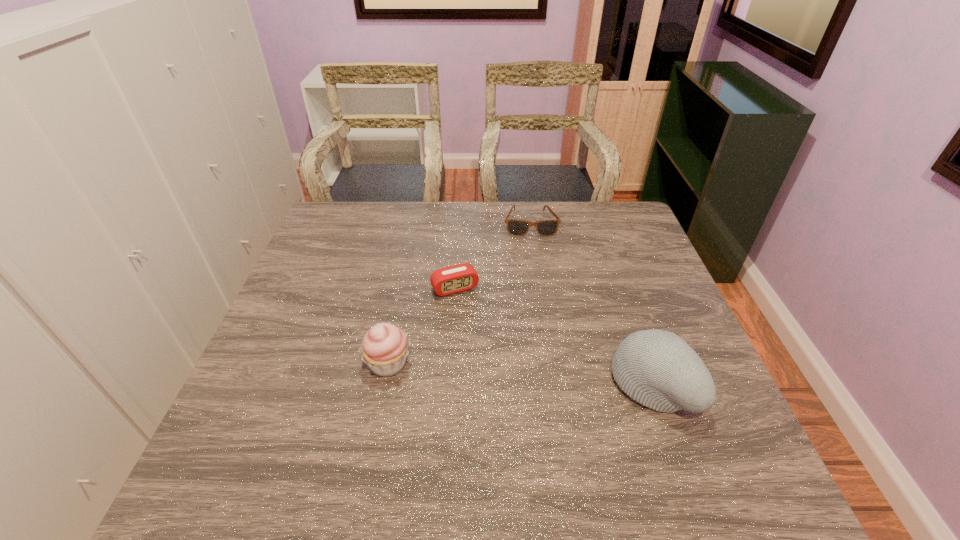
In the image, there is a desktop. Identify the location of free region at the left edge. (240, 396).

Find the location of a particular element. This screenshot has width=960, height=540. vacant space at the right edge is located at coordinates (680, 336).

Locate an element on the screen. This screenshot has height=540, width=960. vacant space at the far left corner is located at coordinates (345, 207).

Where is `vacant point at the far right corner`? The width and height of the screenshot is (960, 540). vacant point at the far right corner is located at coordinates (592, 230).

The width and height of the screenshot is (960, 540). What are the coordinates of `vacant area between the farthest object and the beanie` in the screenshot? It's located at (591, 304).

In order to click on unoccupied area between the second farthest object and the farthest object in this screenshot , I will do `click(492, 256)`.

Where is `vacant space that is in between the beanie and the alarm clock`? The width and height of the screenshot is (960, 540). vacant space that is in between the beanie and the alarm clock is located at coordinates (554, 336).

The image size is (960, 540). Find the location of `free space between the farthest object and the cupcake`. free space between the farthest object and the cupcake is located at coordinates (460, 294).

At what (x,y) coordinates should I click in order to perform the action: click on free spot between the farthest object and the third nearest object. Please return your answer as a coordinate pair (x, y). Image resolution: width=960 pixels, height=540 pixels. Looking at the image, I should click on (492, 256).

Image resolution: width=960 pixels, height=540 pixels. Identify the location of free space between the sunglasses and the rightmost object. (591, 304).